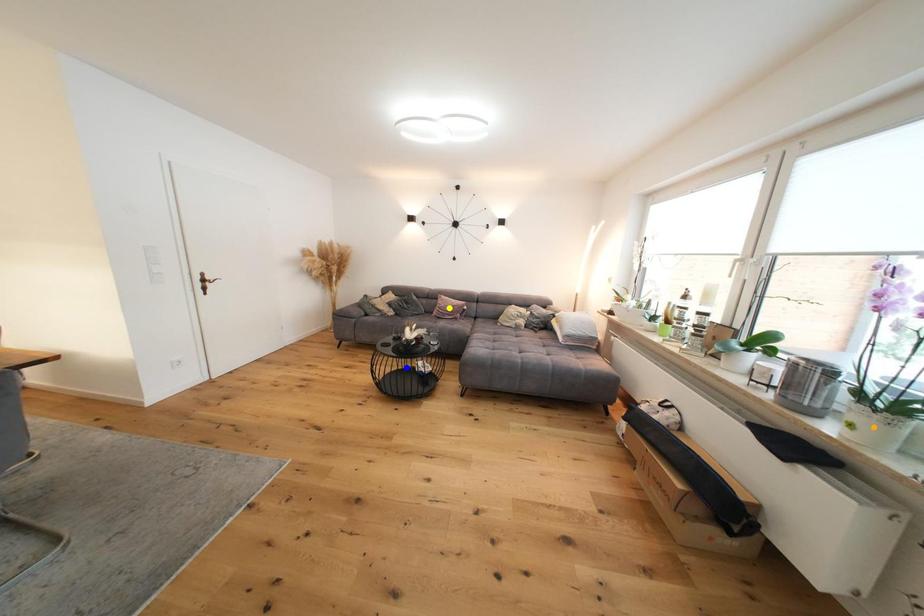
Order these from nearest to farthest:
- orange point
- yellow point
- blue point

orange point
blue point
yellow point